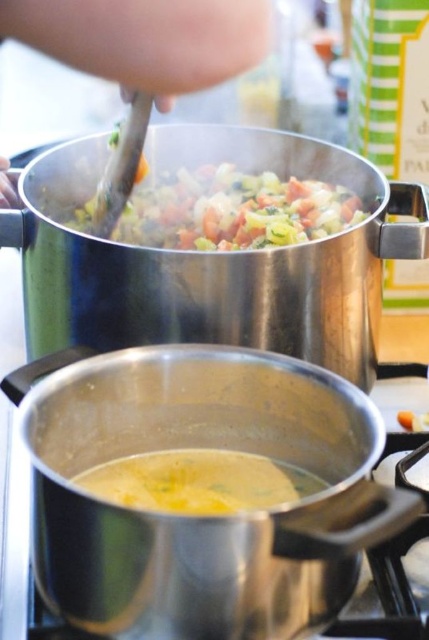
Question: Which object is farther from the camera taking this photo?

Choices:
 (A) vibrant mixed vegetables at upper center
 (B) skinny silver spoon at upper center

Answer: (A)

Question: In this image, where is skinny silver spoon at upper center located relative to vibrant mixed vegetables at upper center?

Choices:
 (A) left
 (B) right

Answer: (A)

Question: Among these objects, which one is farthest from the camera?

Choices:
 (A) vibrant mixed vegetables at upper center
 (B) skinny silver spoon at upper center

Answer: (A)

Question: Is skinny silver spoon at upper center above vibrant mixed vegetables at upper center?

Choices:
 (A) yes
 (B) no

Answer: (A)

Question: Does skinny silver spoon at upper center appear over vibrant mixed vegetables at upper center?

Choices:
 (A) yes
 (B) no

Answer: (A)